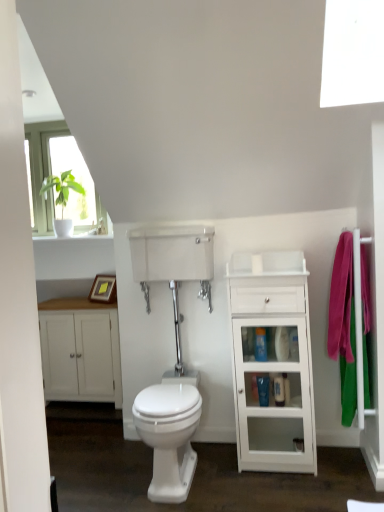
Locate an element on the screen. This screenshot has height=512, width=384. empty space that is ontop of white matte cabinet at left (from a real-world perspective) is located at coordinates (58, 303).